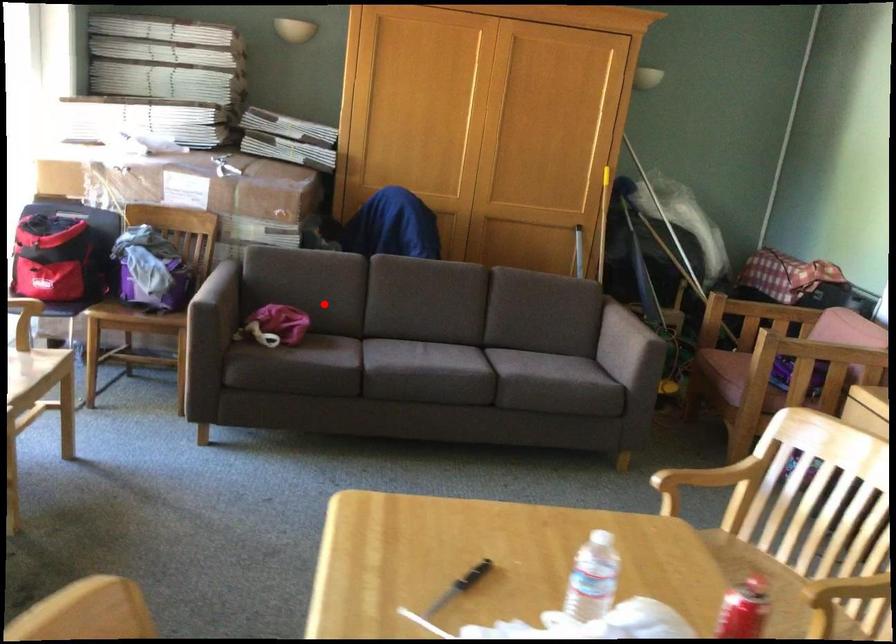
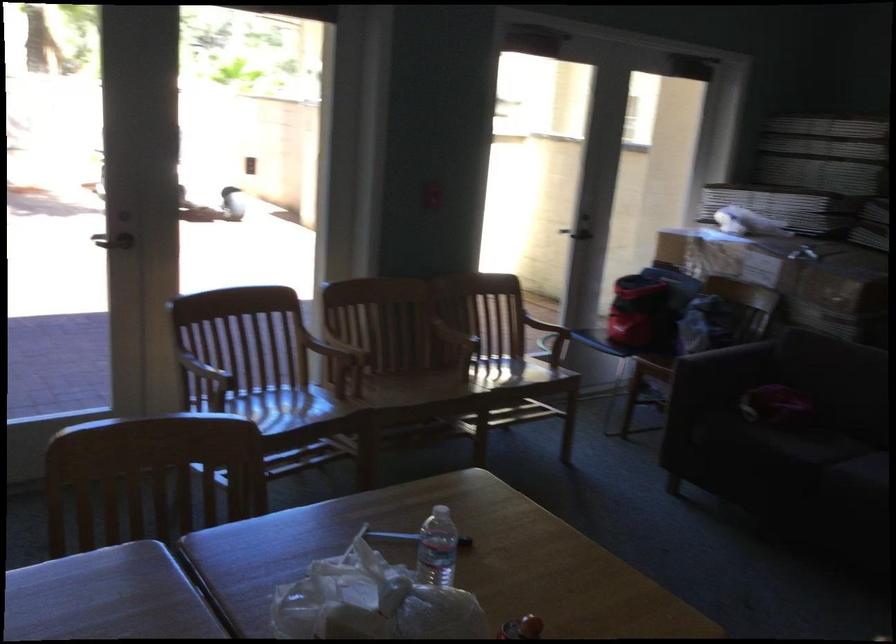
Where in the second image is the point corresponding to the highlighted location from the first image?

(843, 392)